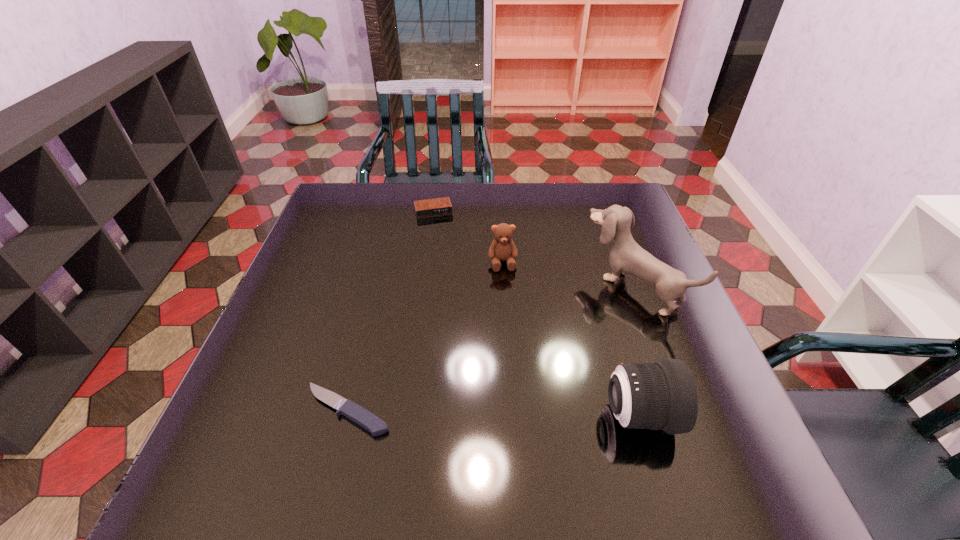
Locate an element on the screen. The width and height of the screenshot is (960, 540). the shortest object is located at coordinates (356, 413).

Find the location of a particular element. This screenshot has height=540, width=960. the fourth shortest object is located at coordinates (662, 395).

The width and height of the screenshot is (960, 540). What are the coordinates of `teddy bear` in the screenshot? It's located at (502, 248).

Find the location of a particular element. Image resolution: width=960 pixels, height=540 pixels. the third shortest object is located at coordinates (502, 248).

Where is `puppy`? Image resolution: width=960 pixels, height=540 pixels. puppy is located at coordinates (626, 256).

Identify the location of the farthest object. (438, 206).

At what (x,y) coordinates should I click in order to perform the action: click on the fourth tallest object. Please return your answer as a coordinate pair (x, y). The height and width of the screenshot is (540, 960). Looking at the image, I should click on (438, 206).

The height and width of the screenshot is (540, 960). What are the coordinates of `vacant space located on the back of the shortest object` in the screenshot? It's located at (373, 304).

Find the location of a particular element. vacant space situated 0.070m at the front element of the second tallest object is located at coordinates (708, 415).

The width and height of the screenshot is (960, 540). Identify the location of vacant space situated on the face of the third tallest object. (508, 306).